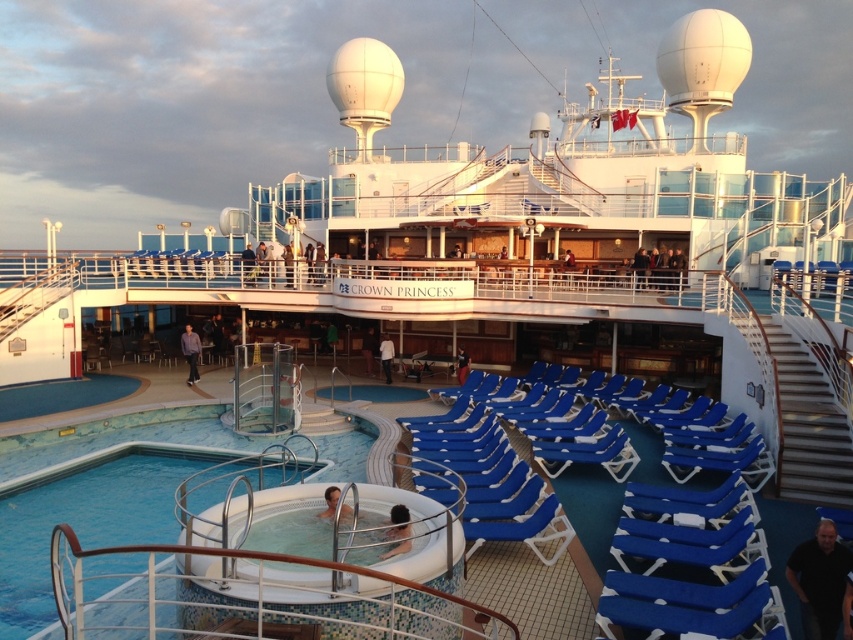
Based on the photo, between dark brown leather jacket at center and dark blue fabric chair at center, which one is positioned higher?

dark brown leather jacket at center is higher up.

Which is in front, point (367, 346) or point (466, 368)?

Point (466, 368) is more forward.

At what (x,y) coordinates should I click in order to perform the action: click on dark brown leather jacket at center. Please return your answer as a coordinate pair (x, y). Looking at the image, I should click on (368, 349).

Who is taller, smooth skin person at center or white fabric shirt at center?

With more height is white fabric shirt at center.

Who is more distant from viewer, (x=405, y=540) or (x=389, y=358)?

Positioned behind is point (x=389, y=358).

Locate an element on the screen. The width and height of the screenshot is (853, 640). smooth skin person at center is located at coordinates (398, 531).

Is smooth skin person at lower center closer to the viewer compared to white fabric shirt at center?

Yes, it is in front of white fabric shirt at center.

Which is behind, point (349, 506) or point (384, 333)?

Point (384, 333)

Is point (325, 499) positioned behind point (381, 337)?

No, it is not.

Find the location of a particular element. smooth skin person at lower center is located at coordinates (329, 500).